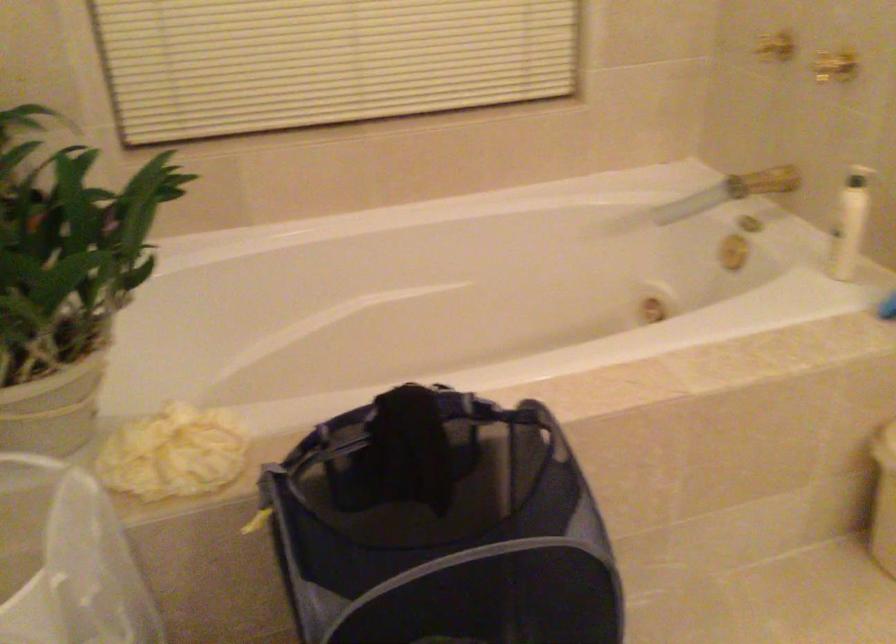
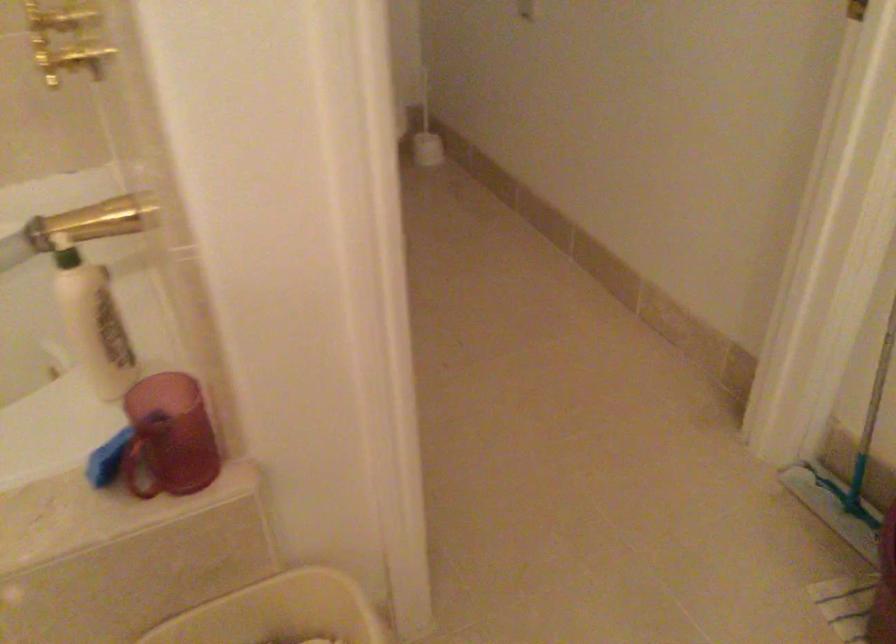
Where in the second image is the point corresponding to the point at 757,175 from the first image?

(95, 222)